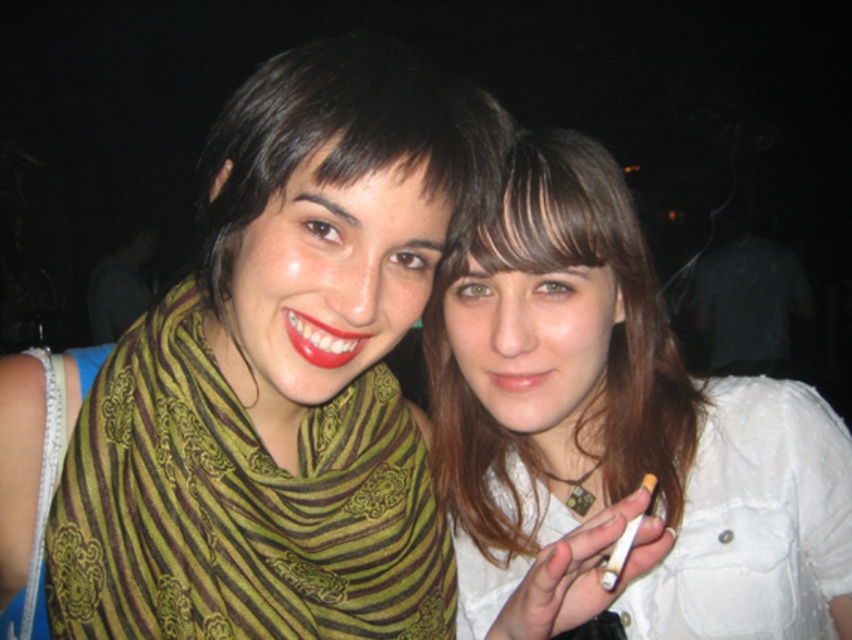
You are a photographer trying to adjust the lighting for a portrait. You notice the green striped scarf at left and the glossy red lipstick at center. Which object should you focus your spotlight on to ensure it stands out more due to its size?

The green striped scarf at left has a greater height compared to the glossy red lipstick at center, so you should focus the spotlight on the green striped scarf at left to ensure it stands out more due to its size.